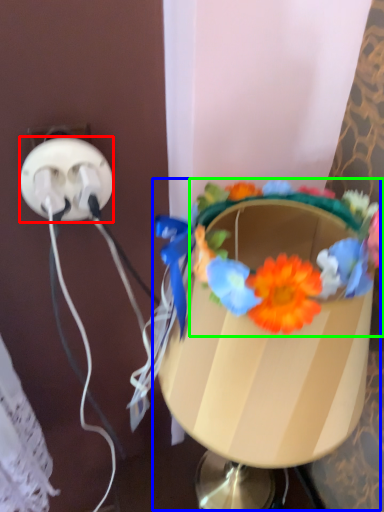
Question: Considering the real-world distances, which object is farthest from power plugs and sockets (highlighted by a red box)? table lamp (highlighted by a blue box) or flower (highlighted by a green box)?

Choices:
 (A) table lamp
 (B) flower

Answer: (A)